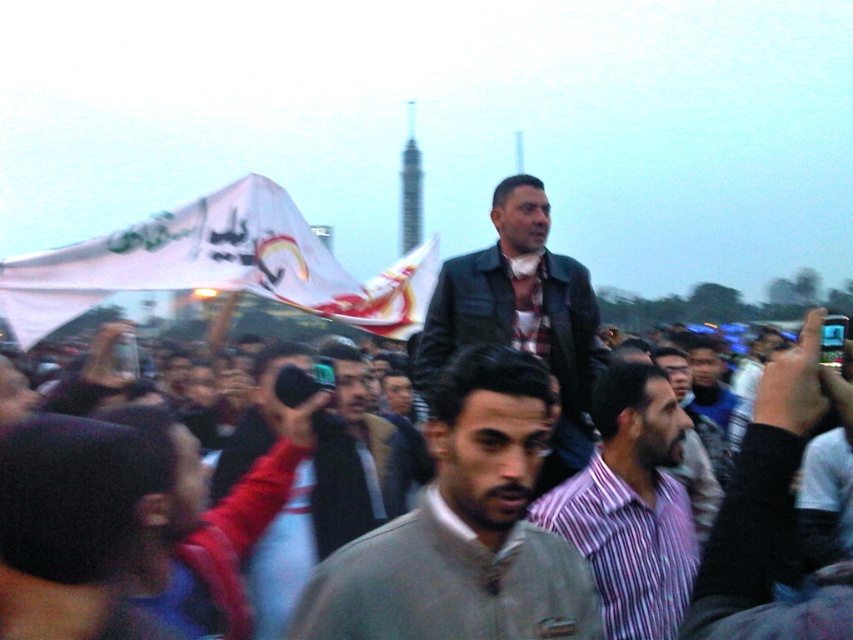
Based on the photo, you are a photographer trying to capture the crowd holding phones. You notice the gray matte jacket at center and the white fabric flag at upper left. Which object is closer to the right side of your frame?

The gray matte jacket at center is positioned on the right side of the white fabric flag at upper left, so it is closer to the right side of the frame.